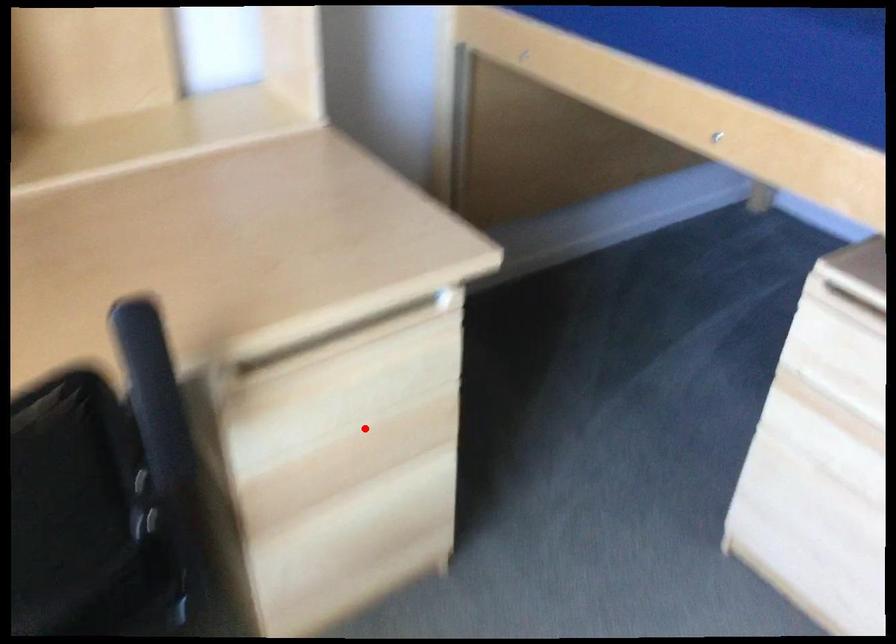
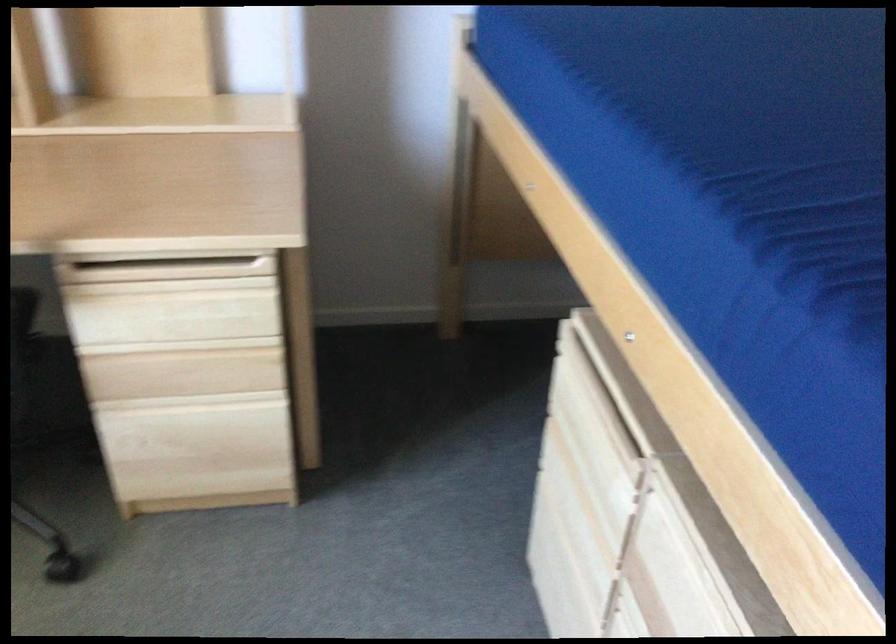
Question: I am providing you with two images of the same scene from different viewpoints. Image1 has a red point marked. In image2, the corresponding 3D location appears at what relative position? Reply with the corresponding letter.

Choices:
 (A) Closer
 (B) Farther

Answer: (B)